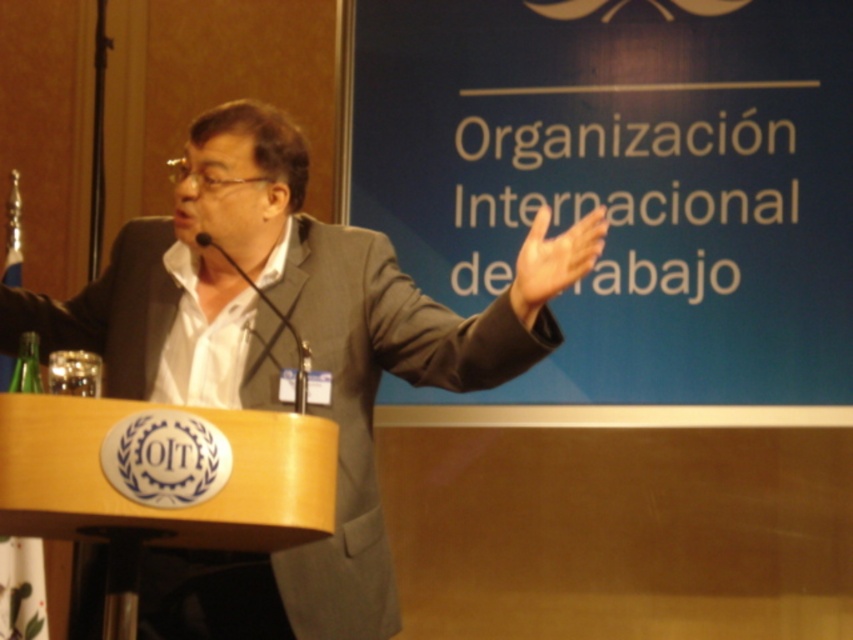
In the scene shown: You are an event photographer at the ILO conference. You need to capture a clear photo of the speaker while ensuring the podium emblem is visible. The gray suit at center and white matte hand at upper center are in your frame. Which object is closer to the camera?

The gray suit at center is closer to the camera because the white matte hand at upper center is behind it.

You are an event photographer at the ILO conference. You need to capture a photo of the speaker wearing the gray suit at center. However, there is a white matte hand at upper center in the way. Can you adjust your camera angle to avoid the hand while still framing the speaker properly?

The gray suit at center is positioned under the white matte hand at upper center. By lowering the camera angle slightly, you can position the shot so the hand is above the frame while still capturing the speaker in the gray suit at center clearly.